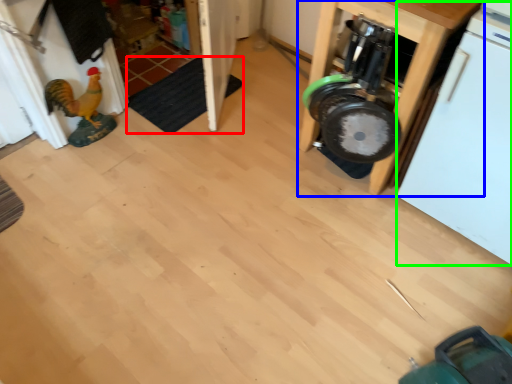
Question: Which object is positioned farthest from mat (highlighted by a red box)? Select from furniture (highlighted by a blue box) and dish washer (highlighted by a green box).

Choices:
 (A) furniture
 (B) dish washer

Answer: (B)